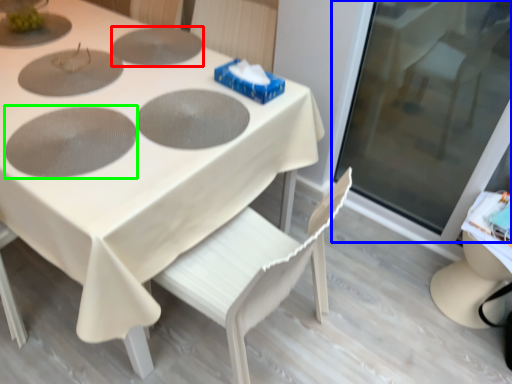
Question: Which object is the farthest from pizza pan (highlighted by a red box)? Choose among these: glass door (highlighted by a blue box) or pizza pan (highlighted by a green box).

Choices:
 (A) glass door
 (B) pizza pan

Answer: (A)